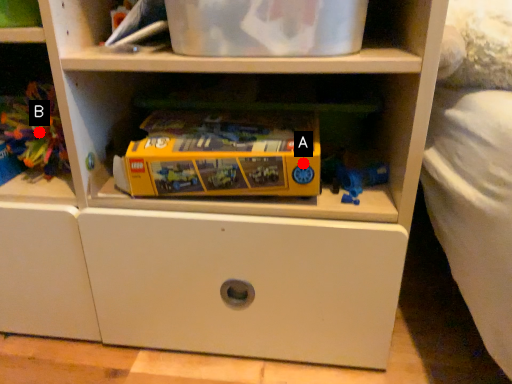
Question: Two points are circled on the image, labeled by A and B beside each circle. Which point is farther to the camera?

Choices:
 (A) A is further
 (B) B is further

Answer: (B)